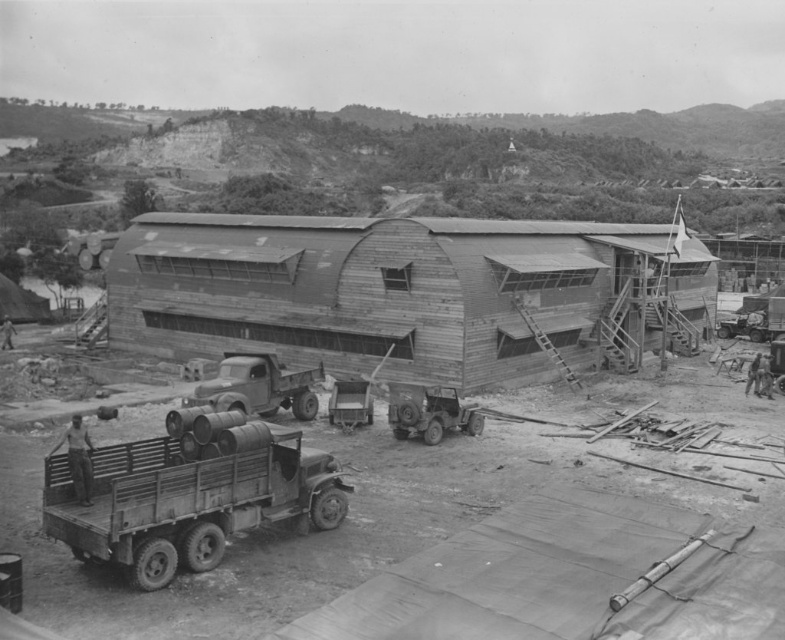
You are a soldier in this military setting and need to locate the wooden hut at center. Based on the coordinates provided, can you determine its exact position relative to the other structures?

The wooden hut at center is located at point coordinates (409, 294), meaning it is positioned slightly to the right and above the central point of the image.

You are a soldier needing to access the large arched wooden building. You see the rusty metal truck at lower left and the matte gray truck at center. Which truck is closer to the building?

The rusty metal truck at lower left is in front of the matte gray truck at center, so it is closer to the building.